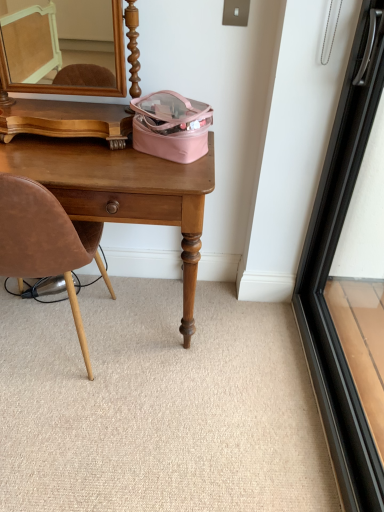
Locate an element on the screen. free spot in front of wooden desk at center is located at coordinates (124, 429).